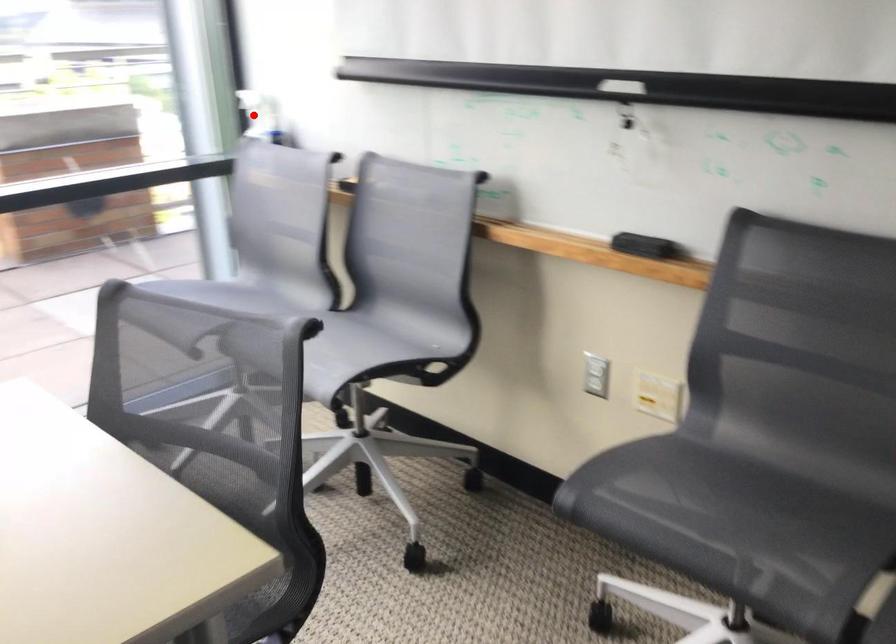
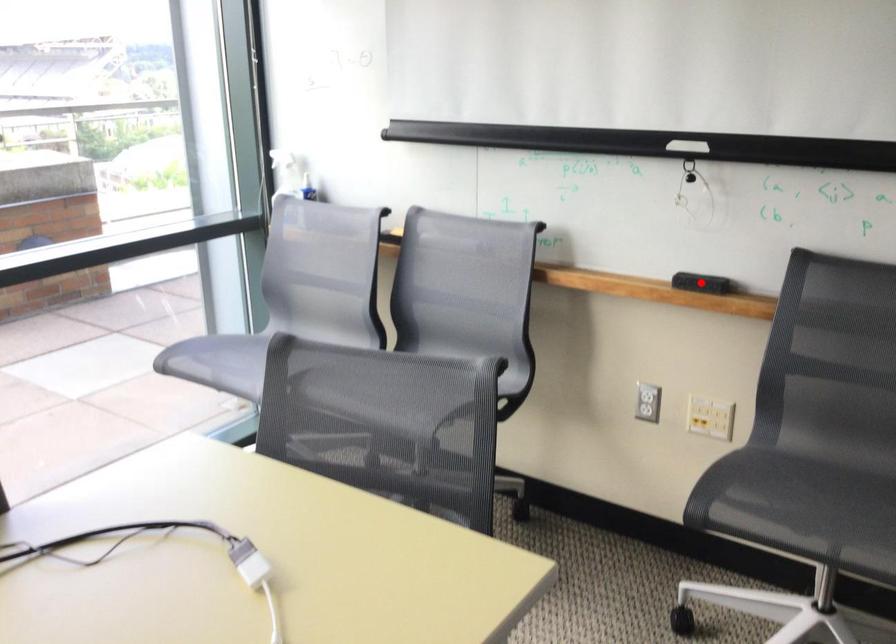
I am providing you with two images of the same scene from different viewpoints. A red point is marked on the first image and another point is marked on the second image. Are the points marked in image1 and image2 representing the same 3D position?

No